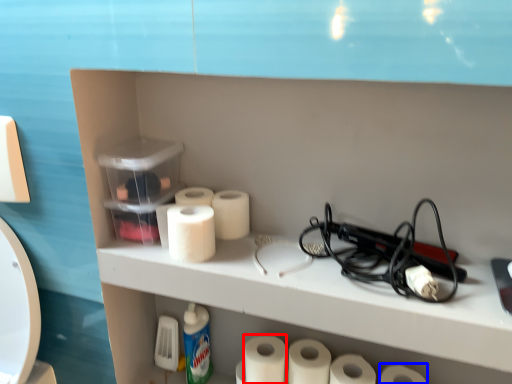
Question: Which of the following is the farthest to the observer, toilet paper (highlighted by a red box) or toilet paper (highlighted by a blue box)?

Choices:
 (A) toilet paper
 (B) toilet paper

Answer: (A)